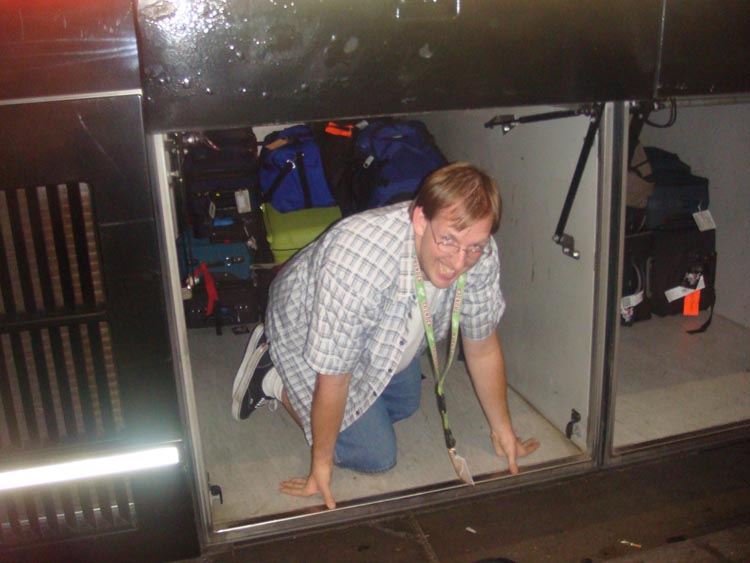
In order to click on sock in this screenshot , I will do `click(272, 381)`.